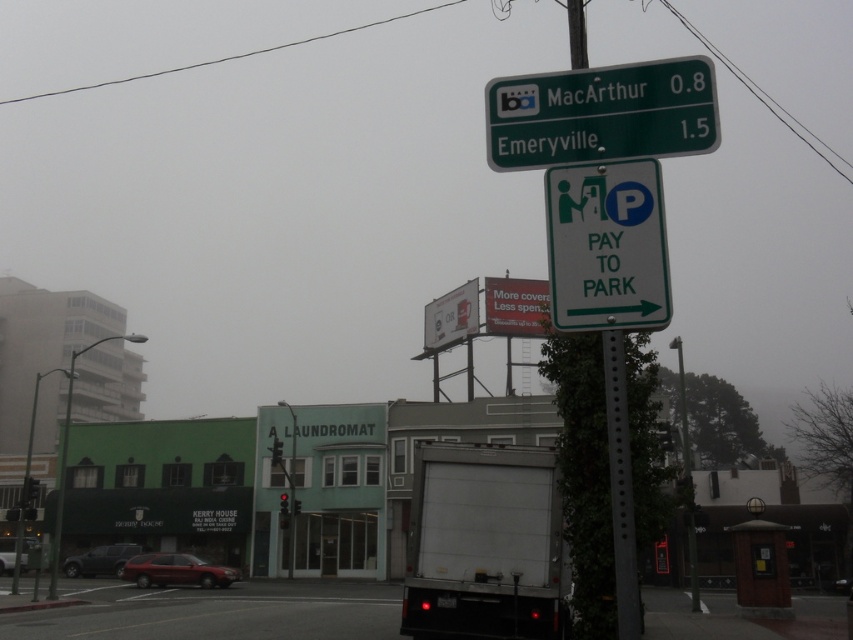
From the picture: Who is more forward, (405, 556) or (543, 104)?

Positioned in front is point (543, 104).

Who is taller, white matte truck at lower center or green metallic street sign at upper center?

green metallic street sign at upper center

You are a GUI agent. You are given a task and a screenshot of the screen. Output one action in this format:
    pyautogui.click(x=<x>, y=<y>)
    Task: Click on the white matte truck at lower center
    
    Given the screenshot: What is the action you would take?
    [485, 545]

This screenshot has width=853, height=640. I want to click on white matte truck at lower center, so click(485, 545).

Is green metallic street sign at upper center further to camera compared to white plastic sign at center right?

Yes, it is behind white plastic sign at center right.

Is point (585, 138) closer to viewer compared to point (637, 298)?

That is False.

You are a GUI agent. You are given a task and a screenshot of the screen. Output one action in this format:
    pyautogui.click(x=<x>, y=<y>)
    Task: Click on the green metallic street sign at upper center
    
    Given the screenshot: What is the action you would take?
    pyautogui.click(x=602, y=113)

Identify the location of green metallic street sign at upper center. click(x=602, y=113).

Which is below, white matte truck at lower center or white plastic sign at center right?

white matte truck at lower center is lower down.

Is white matte truck at lower center to the right of white plastic sign at center right from the viewer's perspective?

Correct, you'll find white matte truck at lower center to the right of white plastic sign at center right.

Where is `white matte truck at lower center`? The height and width of the screenshot is (640, 853). white matte truck at lower center is located at coordinates (485, 545).